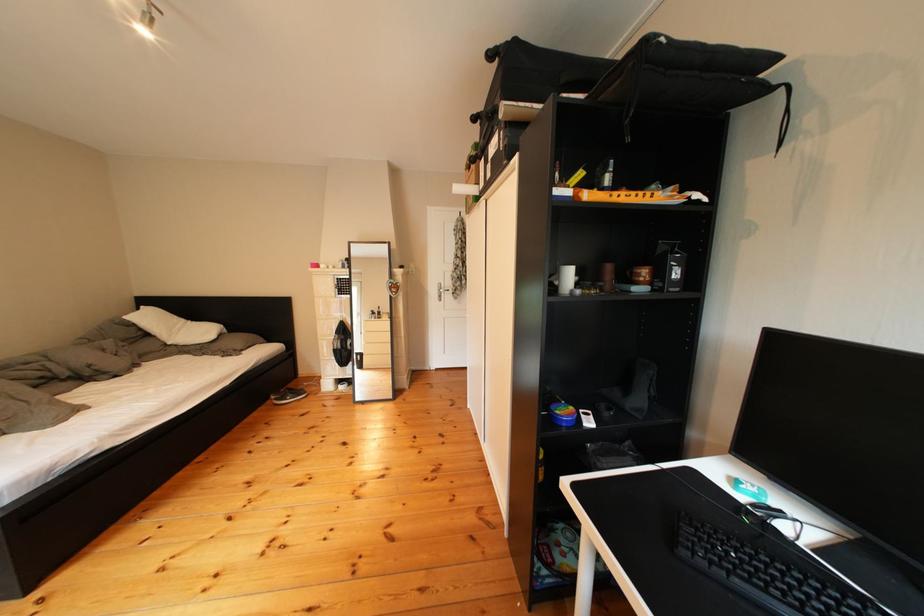
Which object does [604,175] point to?

It corresponds to the white spray bottle in the image.